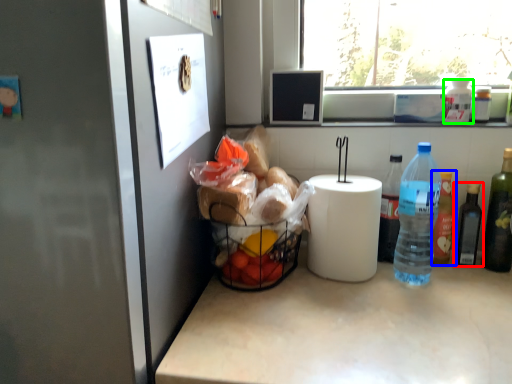
Question: Which is farther away from bottle (highlighted by a red box)? bottle (highlighted by a blue box) or bottle (highlighted by a green box)?

Choices:
 (A) bottle
 (B) bottle

Answer: (B)